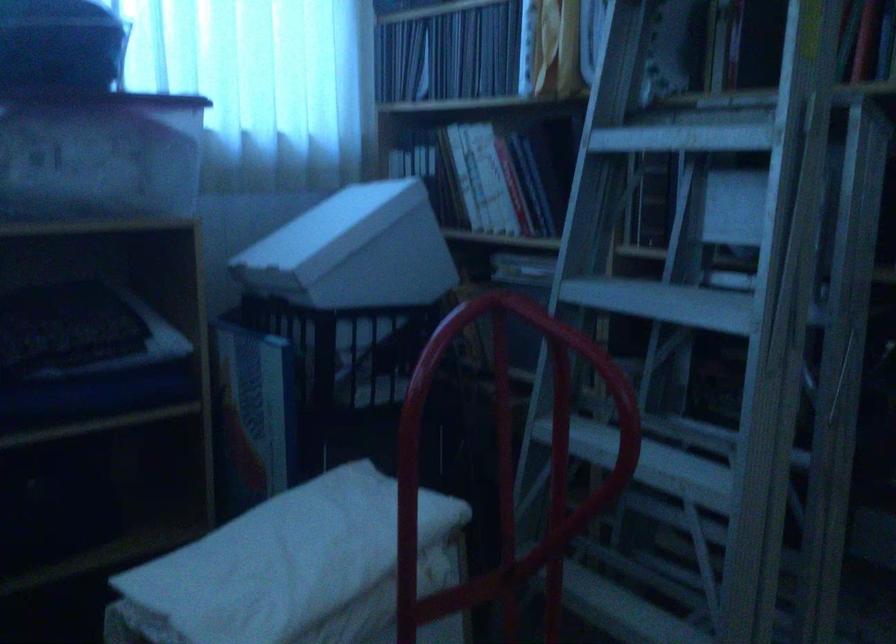
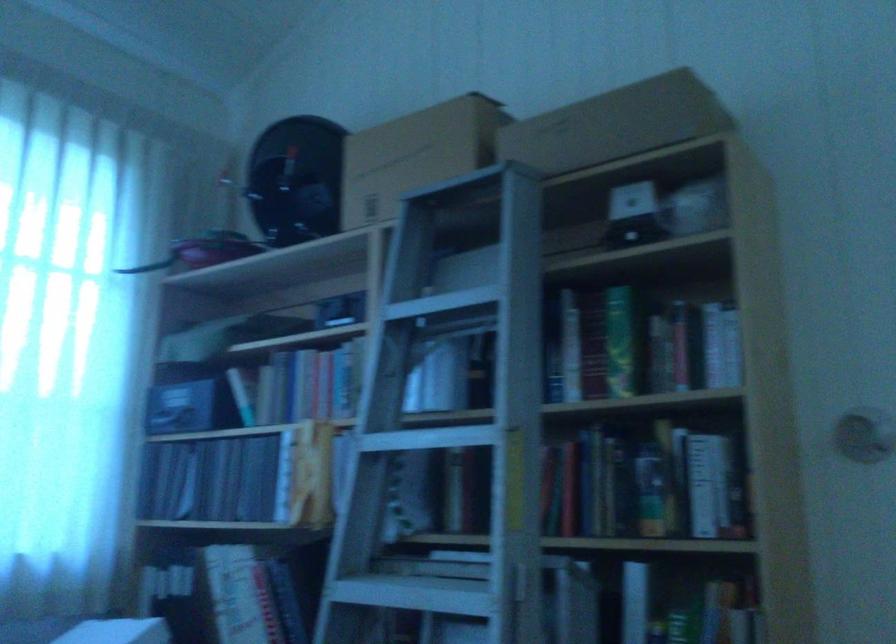
The point at (681, 136) is marked in the first image. Where is the corresponding point in the second image?

(415, 592)